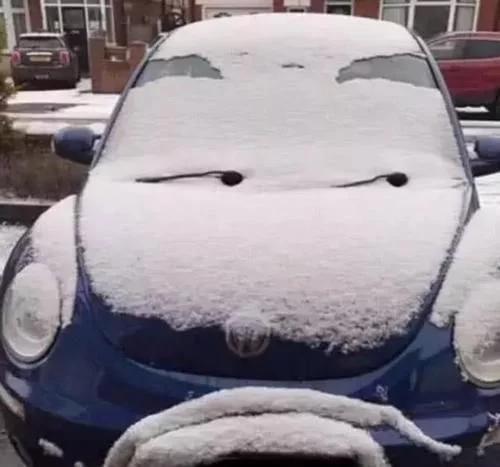
The height and width of the screenshot is (467, 500). In order to click on lights in this screenshot , I will do `click(42, 310)`, `click(486, 348)`.